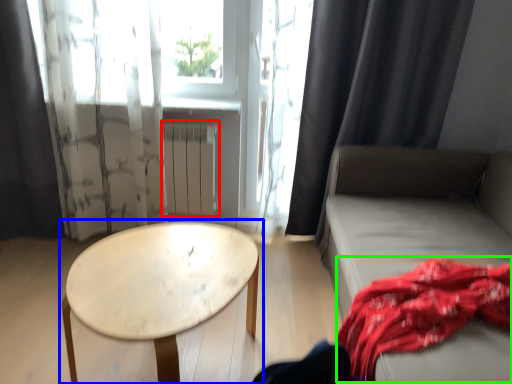
Question: Which object is positioned closest to radiator (highlighted by a red box)? Select from table (highlighted by a blue box) and blanket (highlighted by a green box).

Choices:
 (A) table
 (B) blanket

Answer: (A)